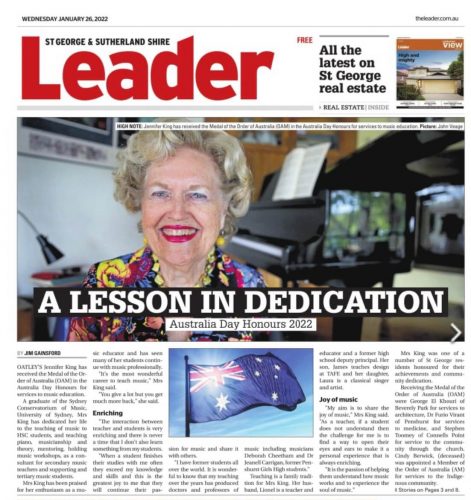
You are a GUI agent. You are given a task and a screenshot of the screen. Output one action in this format:
    pyautogui.click(x=<x>, y=<y>)
    Task: Click on the lamp
    This screenshot has height=500, width=471.
    Given the screenshot: What is the action you would take?
    pyautogui.click(x=43, y=245)